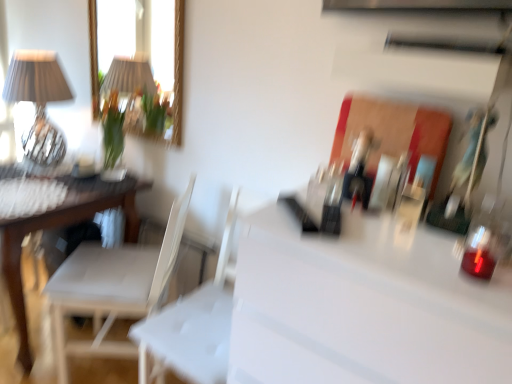
Find the location of a particular element. Image resolution: width=512 pixels, height=384 pixels. free space above white glossy counter top at center (from a real-world perspective) is located at coordinates click(411, 230).